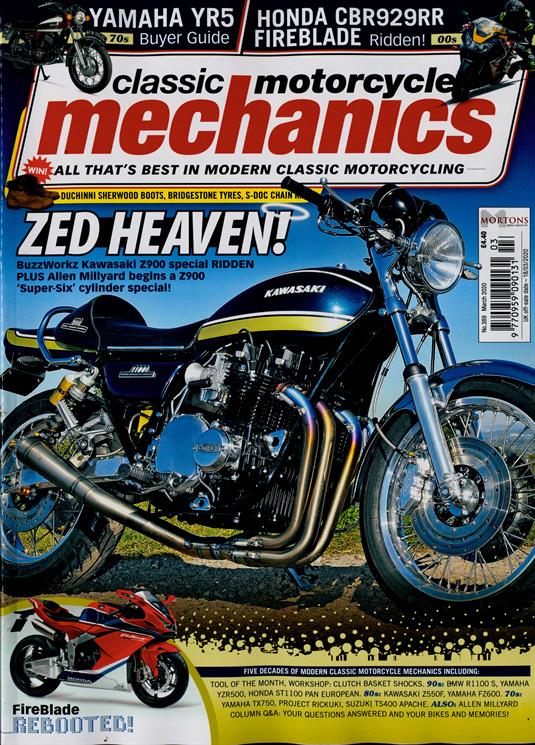
The height and width of the screenshot is (745, 535). In order to click on white floor in this screenshot , I will do `click(137, 706)`, `click(57, 694)`.